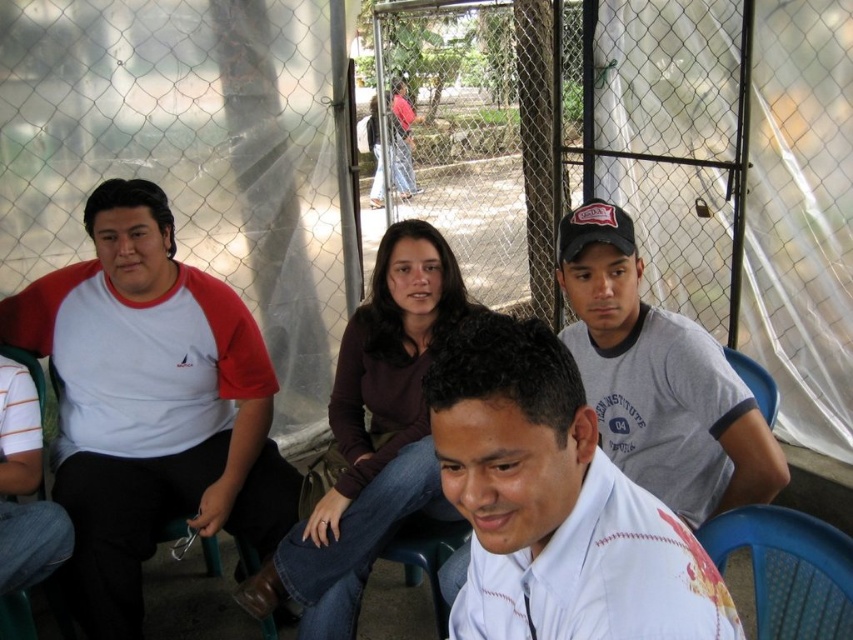
You are standing in front of the temporary structure and want to reach the blue plastic chair at lower right without stepping on the white cotton shirt at left. Is this possible based on their positions?

The white cotton shirt at left is further to the viewer than the blue plastic chair at lower right, so you can walk around or behind the white cotton shirt at left to reach the blue plastic chair at lower right without stepping on it.

Based on the coordinates provided, which object corresponds to the point at (149, 403) in the scene?

The point at (149, 403) corresponds to the white cotton shirt at left.